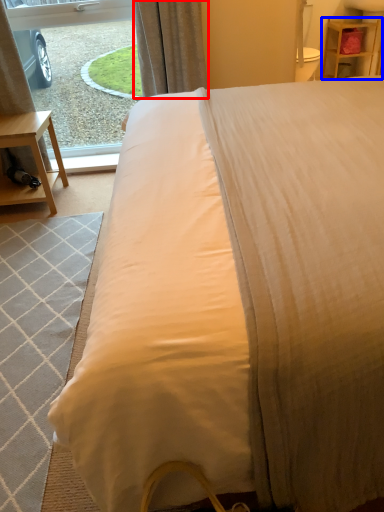
Question: Which object appears closest to the camera in this image, curtain (highlighted by a red box) or nightstand (highlighted by a blue box)?

Choices:
 (A) curtain
 (B) nightstand

Answer: (A)